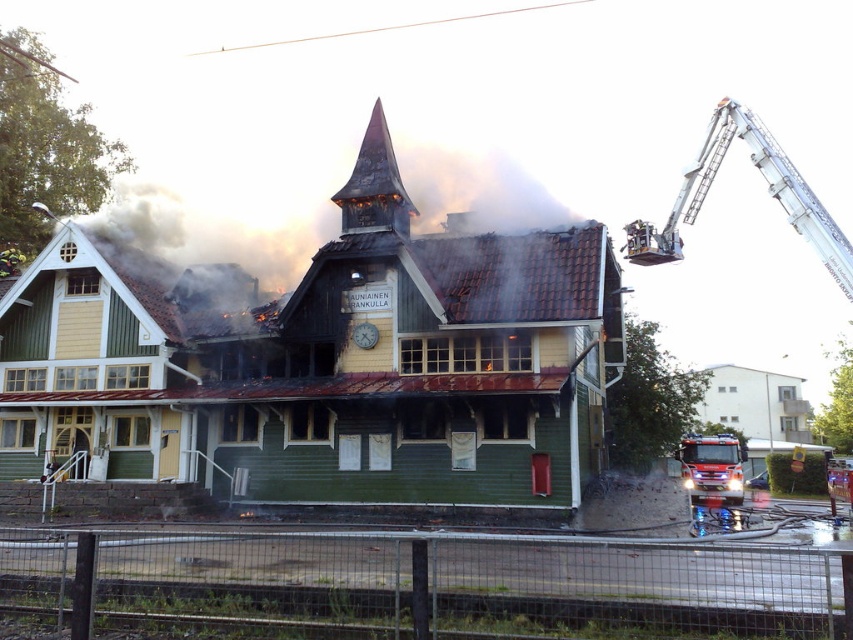
You are a firefighter assessing the scene. You notice the charred wood spire at center and the shiny metallic fire truck at lower right. Which object has a greater width?

The shiny metallic fire truck at lower right has a greater width than the charred wood spire at center.

You are a firefighter assessing the scene of a burning building. You notice a point marked at coordinates (x=374, y=184). Based on the scene description, what structural element is located at that point?

The point at coordinates (x=374, y=184) indicates the charred wood spire at center.